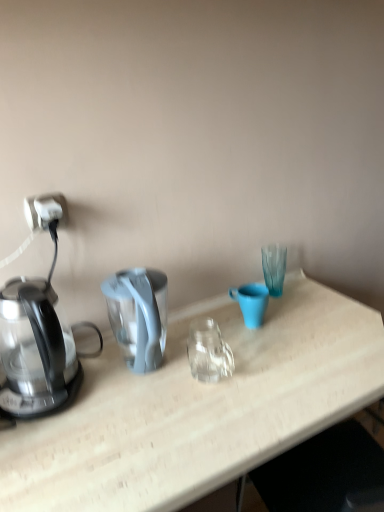
Question: Visually, is matte blue mug at center positioned to the left or to the right of white plastic power outlet at left?

Choices:
 (A) right
 (B) left

Answer: (A)

Question: In terms of size, does matte blue mug at center appear bigger or smaller than white plastic power outlet at left?

Choices:
 (A) big
 (B) small

Answer: (A)

Question: Based on their relative distances, which object is farther from the white plastic power outlet at left?

Choices:
 (A) transparent glass kettle at left
 (B) matte blue mug at center

Answer: (B)

Question: Estimate the real-world distances between objects in this image. Which object is farther from the matte blue mug at center?

Choices:
 (A) white plastic power outlet at left
 (B) transparent glass kettle at left

Answer: (A)